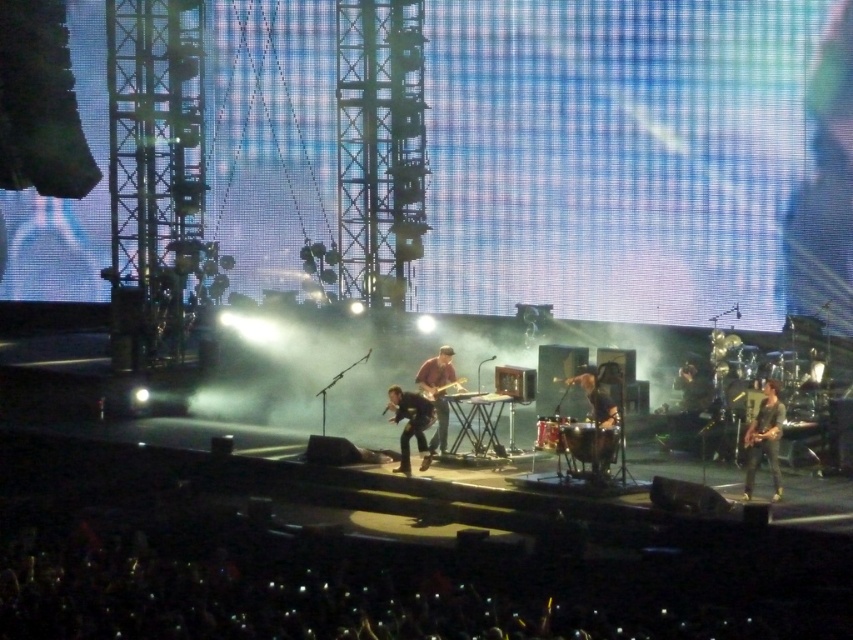
You are a photographer at the concert and want to capture a closeup of the shiny black guitar at right. Based on its position, where should you aim your camera? Please provide coordinates in the format of a point like this example format, e.g., point 0.5,0.5

The shiny black guitar at right is located at point [764,440], so you should aim your camera at point [764,440] to capture it.

You are a stagehand who needs to move a 2.5 meter long ladder from the shiny black guitar at right to the shiny black guitar at center. Can you carry the ladder horizontally between these two guitars without tilting it?

The distance between the shiny black guitar at right and the shiny black guitar at center is 22.20 meters. Since the ladder is only 2.5 meters long, you can easily carry it horizontally between the two guitars without tilting it because the distance between them is much greater than the ladder length.